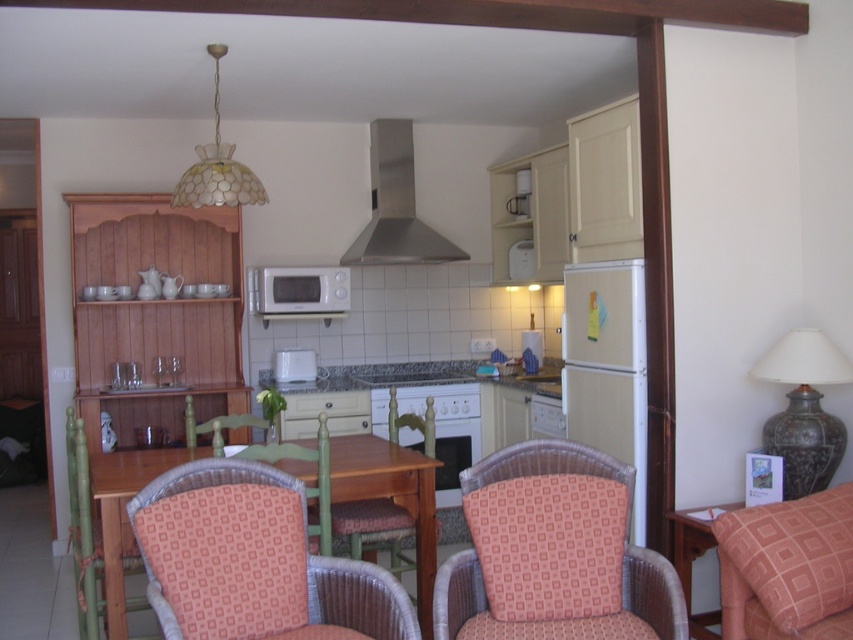
You are standing at the entrance of the kitchen and want to sit in the orange fabric armchair at lower right. According to the coordinates provided, is the armchair closer to the right wall or the left wall?

The orange fabric armchair at lower right is located at point coordinates with an x value of 0.889, which indicates it is closer to the right wall since higher x values typically represent positions further to the right in coordinate systems.

You are planning to place a new decorative item on the orange fabric armchair at lower right. However, there is already a matte dark brown vase at right. Based on the scene description, can you determine if the vase is on top of the armchair or somewhere else?

The orange fabric armchair at lower right is below matte dark brown vase at right, which means the vase is placed above the armchair, not on top of it. Therefore, the vase is likely positioned somewhere above the armchair, such as on a shelf or a higher surface.

You are standing in the kitchen and want to grab a snack from the beige matte refrigerator at right. To reach it, you must pass by the patterned fabric chair at lower left. Which object will you encounter first as you move towards the refrigerator?

You will first encounter the beige matte refrigerator at right because it is closer to you than the patterned fabric chair at lower left, which is further away.